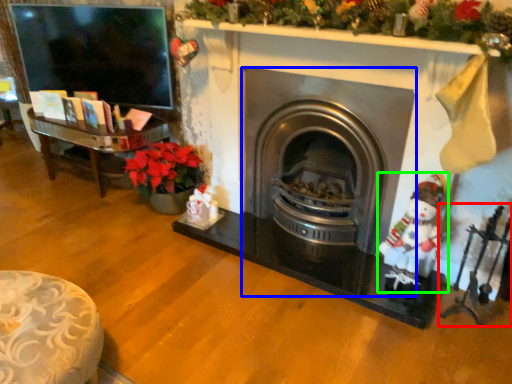
Question: Based on their relative distances, which object is nearer to toy (highlighted by a red box)? Choose from wood burning stove (highlighted by a blue box) and santa claus (highlighted by a green box).

Choices:
 (A) wood burning stove
 (B) santa claus

Answer: (B)